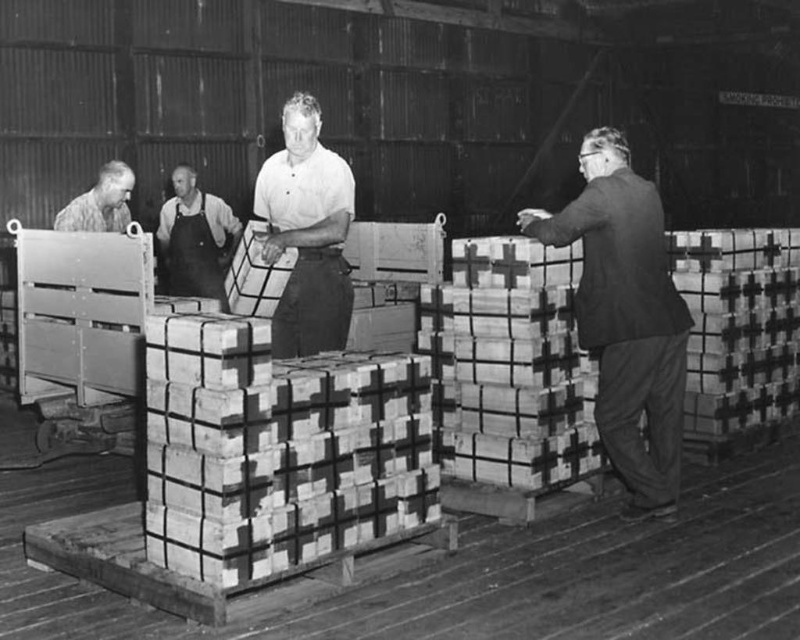
You are a worker in the warehouse and need to determine which clothing item is wider between the smooth dark suit at right and the dark gray apron at center. Which one is wider?

The smooth dark suit at right is wider than the dark gray apron at center.

You are a worker in the warehouse and you need to determine which item is narrower between the smooth white shirt at center and the dark gray apron at center. Which one is it?

The smooth white shirt at center has a lesser width compared to dark gray apron at center, so the smooth white shirt at center is narrower.

You are a security guard in this warehouse and need to identify which person is closer to the entrance. The entrance is located near the crates. Based on the smooth dark suit at right and the smooth white shirt at center, which person is closer to the entrance?

The smooth dark suit at right is closer to the entrance because it is positioned at the right side where the entrance is located near the crates.